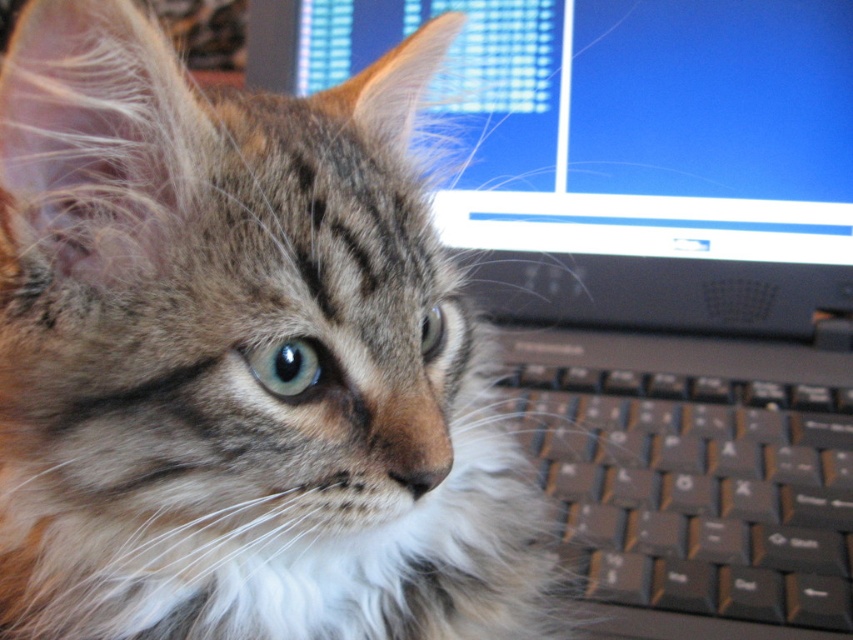
Does matte plastic monitor at upper center have a greater width compared to black plastic keyboard at lower right?

Indeed, matte plastic monitor at upper center has a greater width compared to black plastic keyboard at lower right.

Where is `matte plastic monitor at upper center`? The image size is (853, 640). matte plastic monitor at upper center is located at coordinates (627, 150).

Image resolution: width=853 pixels, height=640 pixels. Describe the element at coordinates (241, 360) in the screenshot. I see `fuzzy tabby cat at center` at that location.

What are the coordinates of `fuzzy tabby cat at center` in the screenshot? It's located at (241, 360).

From the picture: Which of these two, fuzzy tabby cat at center or matte plastic monitor at upper center, stands shorter?

Standing shorter between the two is matte plastic monitor at upper center.

Between fuzzy tabby cat at center and matte plastic monitor at upper center, which one appears on the right side from the viewer's perspective?

Positioned to the right is matte plastic monitor at upper center.

You are a GUI agent. You are given a task and a screenshot of the screen. Output one action in this format:
    pyautogui.click(x=<x>, y=<y>)
    Task: Click on the fuzzy tabby cat at center
    
    Given the screenshot: What is the action you would take?
    pyautogui.click(x=241, y=360)